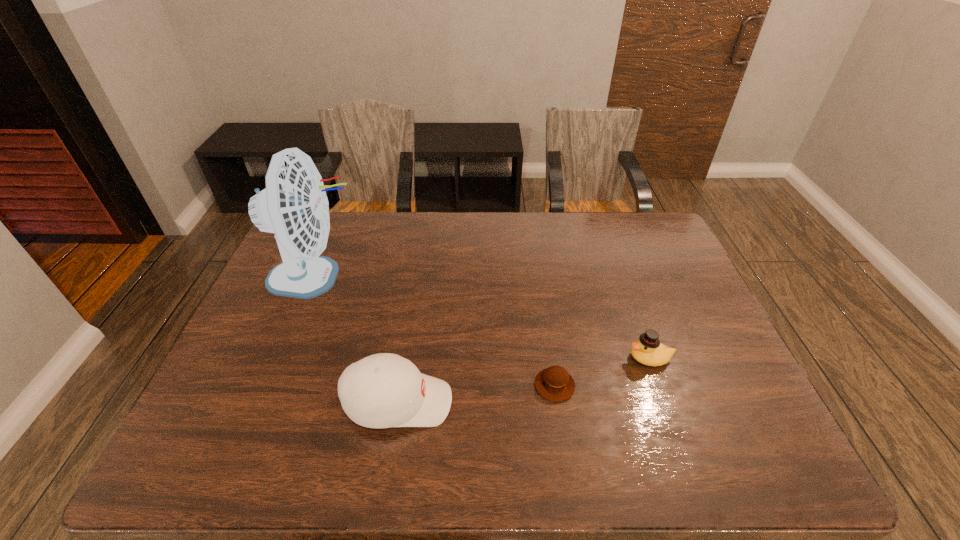
Find the location of `vacant space that is in between the tallest object and the shortest object`. vacant space that is in between the tallest object and the shortest object is located at coordinates (435, 332).

Locate an element on the screen. Image resolution: width=960 pixels, height=540 pixels. free point between the third tallest object and the third object from right to left is located at coordinates (524, 380).

Locate an element on the screen. free spot between the second shortest object and the shortest object is located at coordinates (602, 372).

Identify the location of free space between the third tallest object and the tallest object. This screenshot has height=540, width=960. (483, 318).

Identify the location of object that ranks as the third closest to the second object from right to left. (294, 205).

Identify which object is the second nearest to the leftmost object. Please provide its 2D coordinates. Your answer should be formatted as a tuple, i.e. [(x, y)], where the tuple contains the x and y coordinates of a point satisfying the conditions above.

[(554, 383)]

Locate an element on the screen. This screenshot has height=540, width=960. vacant point that satisfies the following two spatial constraints: 1. on the grille of the muffin; 2. on the right side of the farthest object is located at coordinates (271, 386).

The width and height of the screenshot is (960, 540). Identify the location of free space that satisfies the following two spatial constraints: 1. on the grille of the fan; 2. on the right side of the second object from right to left. (271, 386).

Identify the location of vacant space that satisfies the following two spatial constraints: 1. on the back side of the third object from left to right; 2. on the grille of the fan. (539, 278).

Find the location of a particular element. blank area in the image that satisfies the following two spatial constraints: 1. on the front side of the muffin; 2. on the front-facing side of the third shortest object is located at coordinates (557, 402).